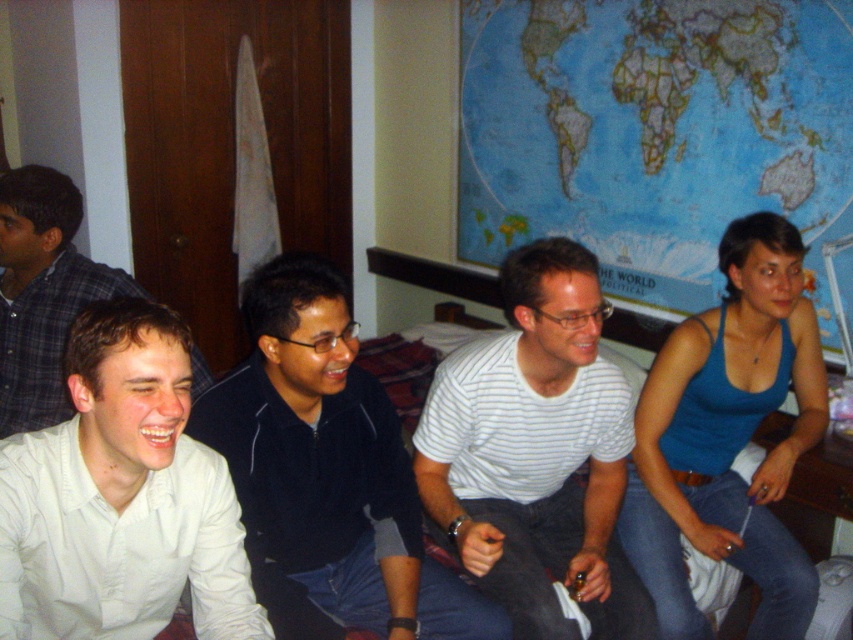
Question: Can you confirm if blue paper map at upper center is positioned to the left of black zip-up jacket at center?

Choices:
 (A) no
 (B) yes

Answer: (A)

Question: Which point is farther to the camera?

Choices:
 (A) (68, 216)
 (B) (612, 403)

Answer: (A)

Question: Which is farther from the white shirt at left?

Choices:
 (A) black zip-up jacket at center
 (B) white striped shirt at center

Answer: (B)

Question: Does blue paper map at upper center have a larger size compared to blue tank top at right?

Choices:
 (A) no
 (B) yes

Answer: (B)

Question: Estimate the real-world distances between objects in this image. Which object is closer to the black zip-up jacket at center?

Choices:
 (A) white shirt at center
 (B) blue paper map at upper center
 (C) white shirt at left
 (D) white striped shirt at center

Answer: (D)

Question: Is black zip-up jacket at center above blue tank top at right?

Choices:
 (A) yes
 (B) no

Answer: (B)